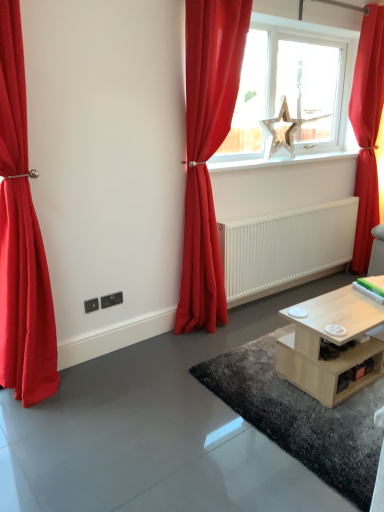
You are a GUI agent. You are given a task and a screenshot of the screen. Output one action in this format:
    pyautogui.click(x=<x>, y=<y>)
    Task: Click on the vacant area in front of matte red curtain at left, the first curtain positioned from the left
    The image size is (384, 512).
    Given the screenshot: What is the action you would take?
    pyautogui.click(x=36, y=434)